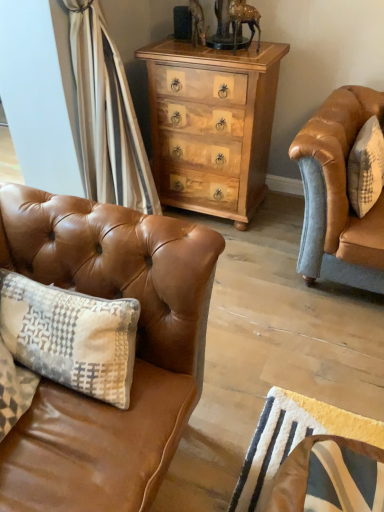
Question: Is leather swivel chair at lower right inside saddle brown leather couch at left?

Choices:
 (A) yes
 (B) no

Answer: (B)

Question: Does saddle brown leather couch at left appear on the right side of leather swivel chair at lower right?

Choices:
 (A) yes
 (B) no

Answer: (B)

Question: Is saddle brown leather couch at left in front of leather swivel chair at lower right?

Choices:
 (A) yes
 (B) no

Answer: (B)

Question: Is saddle brown leather couch at left beside leather swivel chair at lower right?

Choices:
 (A) no
 (B) yes

Answer: (A)

Question: Is saddle brown leather couch at left completely or partially outside of leather swivel chair at lower right?

Choices:
 (A) yes
 (B) no

Answer: (A)

Question: Do you think white textured pillow at right is within saddle brown leather couch at left, or outside of it?

Choices:
 (A) outside
 (B) inside

Answer: (A)

Question: Is point (372, 203) closer or farther from the camera than point (192, 225)?

Choices:
 (A) closer
 (B) farther

Answer: (B)

Question: Looking at the image, does white textured pillow at right seem bigger or smaller compared to saddle brown leather couch at left?

Choices:
 (A) big
 (B) small

Answer: (B)

Question: In terms of width, does white textured pillow at right look wider or thinner when compared to saddle brown leather couch at left?

Choices:
 (A) thin
 (B) wide

Answer: (A)

Question: From the image's perspective, is leather swivel chair at lower right positioned above or below white textured pillow at right?

Choices:
 (A) below
 (B) above

Answer: (A)

Question: From a real-world perspective, is leather swivel chair at lower right positioned above or below white textured pillow at right?

Choices:
 (A) above
 (B) below

Answer: (B)

Question: Relative to white textured pillow at right, is leather swivel chair at lower right in front or behind?

Choices:
 (A) behind
 (B) front

Answer: (B)

Question: Is leather swivel chair at lower right taller or shorter than white textured pillow at right?

Choices:
 (A) short
 (B) tall

Answer: (B)

Question: Considering the positions of point (377, 193) and point (312, 464), is point (377, 193) closer or farther from the camera than point (312, 464)?

Choices:
 (A) farther
 (B) closer

Answer: (A)

Question: In terms of width, does white textured pillow at right look wider or thinner when compared to leather swivel chair at lower right?

Choices:
 (A) wide
 (B) thin

Answer: (B)